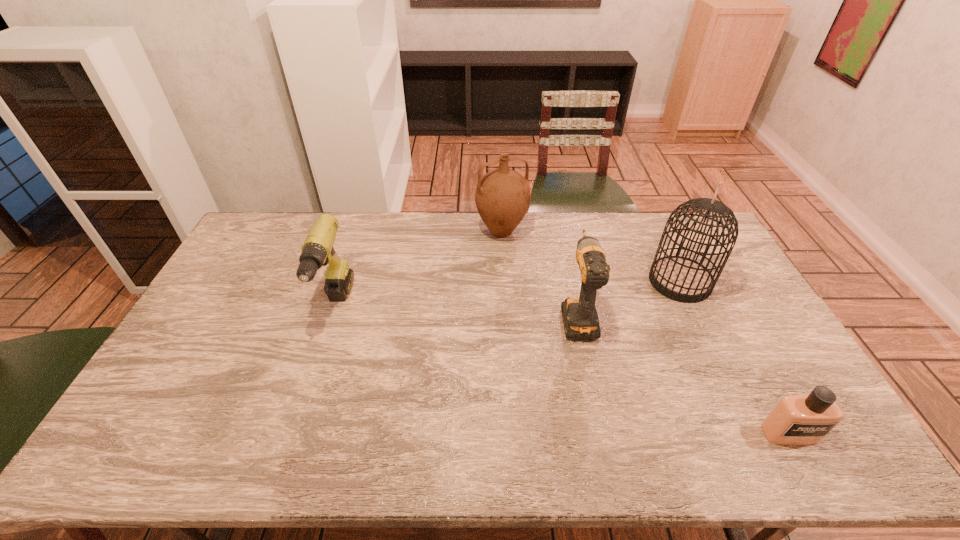
This screenshot has width=960, height=540. In order to click on object that is the second closest to the farthest object in this screenshot , I will do `click(679, 278)`.

Image resolution: width=960 pixels, height=540 pixels. In order to click on object that is the third closest to the shortest object in this screenshot , I will do pyautogui.click(x=502, y=197).

What are the coordinates of `vacant region that satisfies the following two spatial constraints: 1. on the front side of the fourth object from right to left; 2. on the right side of the tallest object` in the screenshot? It's located at (504, 282).

I want to click on free location that satisfies the following two spatial constraints: 1. on the front side of the tallest object; 2. on the left side of the fourth object from right to left, so click(504, 282).

Locate an element on the screen. The image size is (960, 540). vacant position in the image that satisfies the following two spatial constraints: 1. with the drill bit of the right drill facing forward; 2. on the right side of the tallest object is located at coordinates (570, 282).